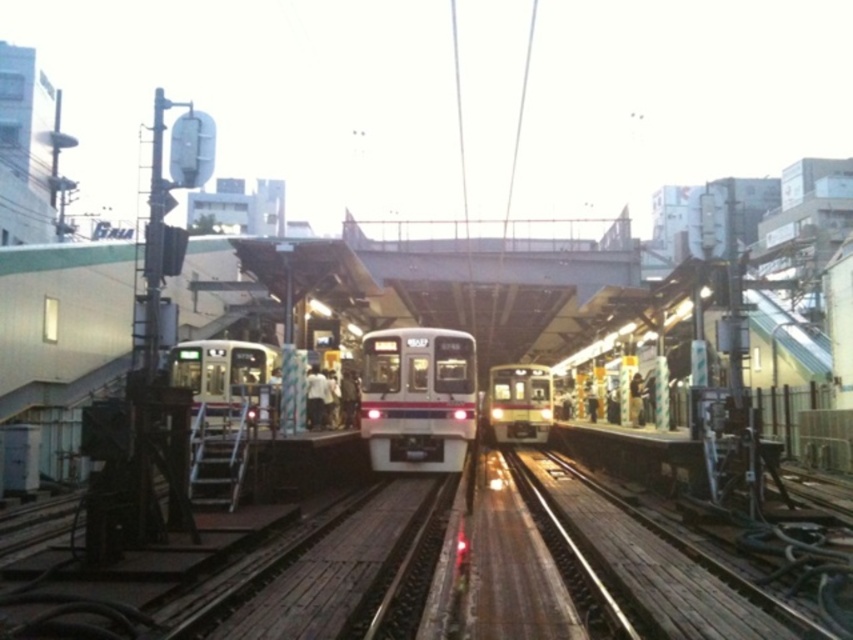
Which of these two, wooden planks at center or white glossy train at center, stands shorter?

With less height is wooden planks at center.

The height and width of the screenshot is (640, 853). Describe the element at coordinates (663, 564) in the screenshot. I see `wooden planks at center` at that location.

Identify the location of wooden planks at center. This screenshot has width=853, height=640. (663, 564).

Is the position of silver metallic train at center less distant than that of white glossy train at center?

No, silver metallic train at center is further to the viewer.

Can you confirm if silver metallic train at center is positioned above white glossy train at center?

Incorrect, silver metallic train at center is not positioned above white glossy train at center.

Between point (433, 458) and point (202, 381), which one is positioned behind?

Positioned behind is point (202, 381).

Find the location of a particular element. This screenshot has width=853, height=640. silver metallic train at center is located at coordinates (416, 397).

How distant is silver metallic train at center from metallic silver train at center?

A distance of 14.95 meters exists between silver metallic train at center and metallic silver train at center.

This screenshot has width=853, height=640. I want to click on silver metallic train at center, so click(x=416, y=397).

The width and height of the screenshot is (853, 640). What do you see at coordinates (416, 397) in the screenshot? I see `silver metallic train at center` at bounding box center [416, 397].

At what (x,y) coordinates should I click in order to perform the action: click on silver metallic train at center. Please return your answer as a coordinate pair (x, y). The height and width of the screenshot is (640, 853). Looking at the image, I should click on (416, 397).